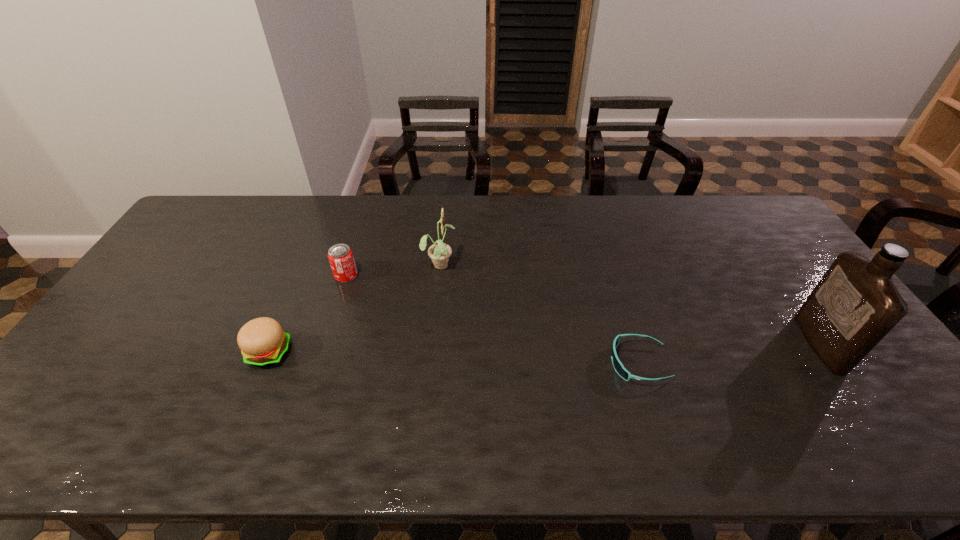
Locate an element on the screen. vacant area that lies between the can and the rightmost object is located at coordinates (583, 309).

In order to click on vacant area that lies between the sunglasses and the hamburger in this screenshot , I will do `click(453, 358)`.

Where is `vacant region between the shortest object and the leftmost object`? The image size is (960, 540). vacant region between the shortest object and the leftmost object is located at coordinates (453, 358).

You are a GUI agent. You are given a task and a screenshot of the screen. Output one action in this format:
    pyautogui.click(x=<x>, y=<y>)
    Task: Click on the object that is the fourth closest to the shortest object
    
    Given the screenshot: What is the action you would take?
    pyautogui.click(x=262, y=341)

Identify which object is the fourth closest to the leftmost object. Please provide its 2D coordinates. Your answer should be formatted as a tuple, i.e. [(x, y)], where the tuple contains the x and y coordinates of a point satisfying the conditions above.

[(855, 305)]